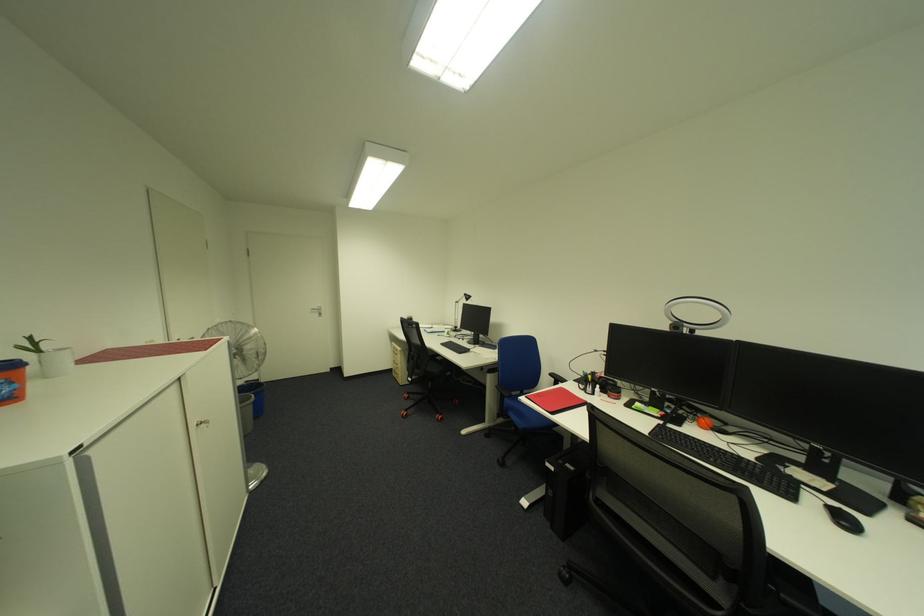
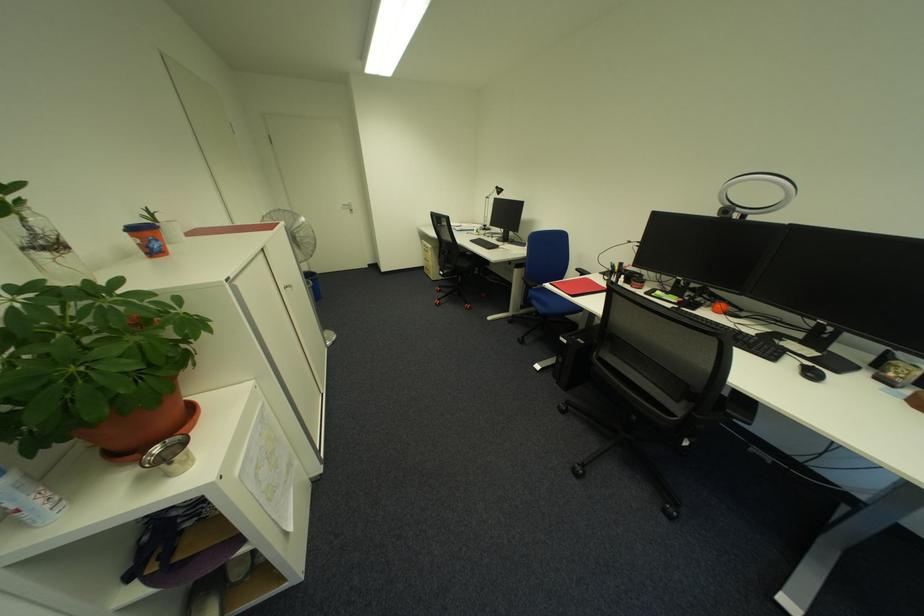
The point at [321,313] is marked in the first image. Where is the corresponding point in the second image?

(353, 209)